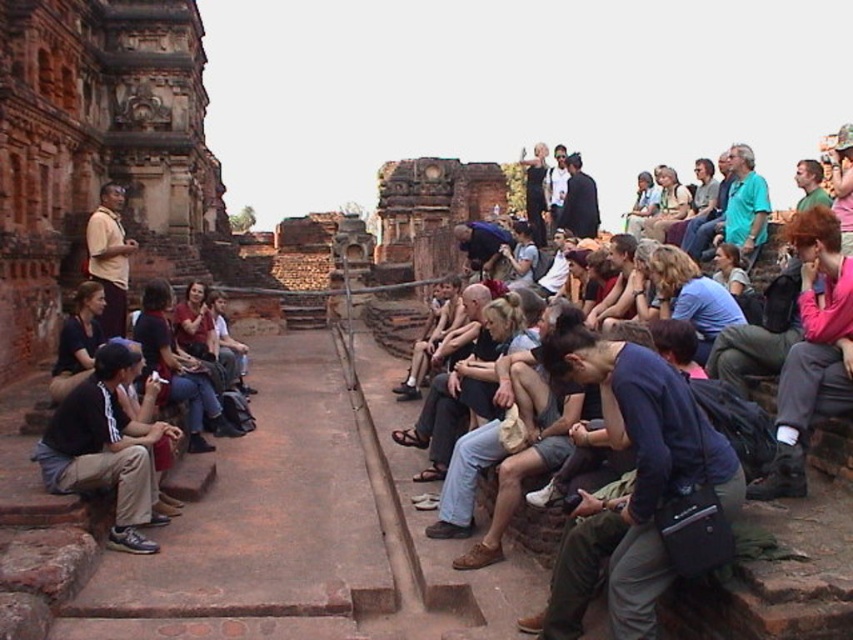
Question: Where is dark brown cotton pants at left located in relation to dark blue jeans at center in the image?

Choices:
 (A) left
 (B) right

Answer: (B)

Question: Which point appears farthest from the camera in this image?

Choices:
 (A) tap(167, 516)
 (B) tap(799, 410)

Answer: (A)

Question: Among these objects, which one is nearest to the camera?

Choices:
 (A) dark blue jeans at center
 (B) dark brown cotton pants at left
 (C) pink fabric jacket at right

Answer: (C)

Question: Can you confirm if pink fabric jacket at right is wider than dark brown cotton pants at left?

Choices:
 (A) yes
 (B) no

Answer: (A)

Question: Does pink fabric jacket at right appear on the left side of dark blue jeans at center?

Choices:
 (A) no
 (B) yes

Answer: (A)

Question: Estimate the real-world distances between objects in this image. Which object is farther from the dark blue jeans at center?

Choices:
 (A) pink fabric jacket at right
 (B) dark brown cotton pants at left

Answer: (A)